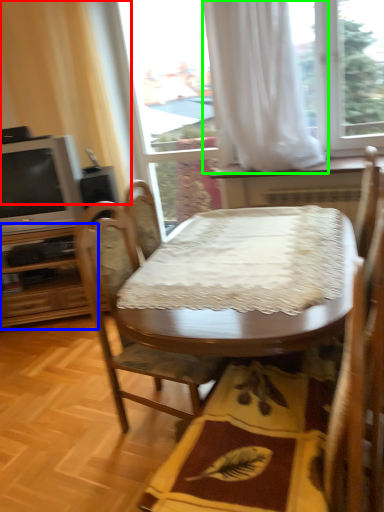
Question: Considering the real-world distances, which object is closest to curtain (highlighted by a red box)? dresser (highlighted by a blue box) or curtain (highlighted by a green box).

Choices:
 (A) dresser
 (B) curtain

Answer: (A)